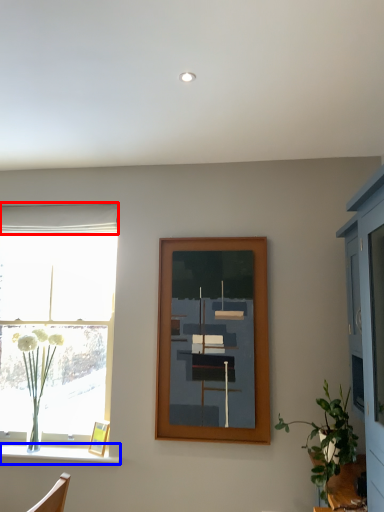
Question: Among these objects, which one is farthest to the camera, curtain (highlighted by a red box) or window sill (highlighted by a blue box)?

Choices:
 (A) curtain
 (B) window sill

Answer: (A)